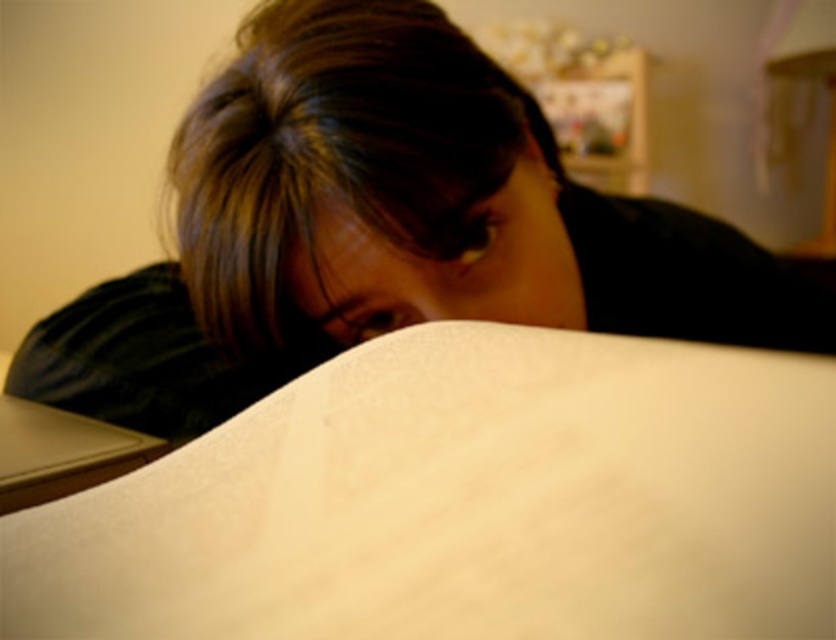
Question: Does white matte blanket at lower center appear on the left side of matte black hair at upper center?

Choices:
 (A) no
 (B) yes

Answer: (A)

Question: Is white matte blanket at lower center smaller than matte black hair at upper center?

Choices:
 (A) no
 (B) yes

Answer: (B)

Question: Estimate the real-world distances between objects in this image. Which object is farther from the white matte blanket at lower center?

Choices:
 (A) matte black hair at upper center
 (B) black matte laptop at lower left

Answer: (B)

Question: Which object is closer to the camera taking this photo?

Choices:
 (A) white matte blanket at lower center
 (B) matte black hair at upper center

Answer: (A)

Question: Can you confirm if white matte blanket at lower center is positioned to the right of black matte laptop at lower left?

Choices:
 (A) no
 (B) yes

Answer: (B)

Question: Among these points, which one is farthest from the camera?

Choices:
 (A) (732, 620)
 (B) (60, 392)
 (C) (31, 493)

Answer: (B)